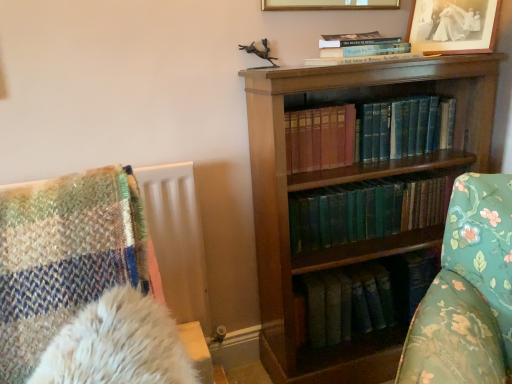
Identify the location of free location above green leather book at center, positioned as the third book in top-to-bottom order (from a real-world perspective). The height and width of the screenshot is (384, 512). (357, 186).